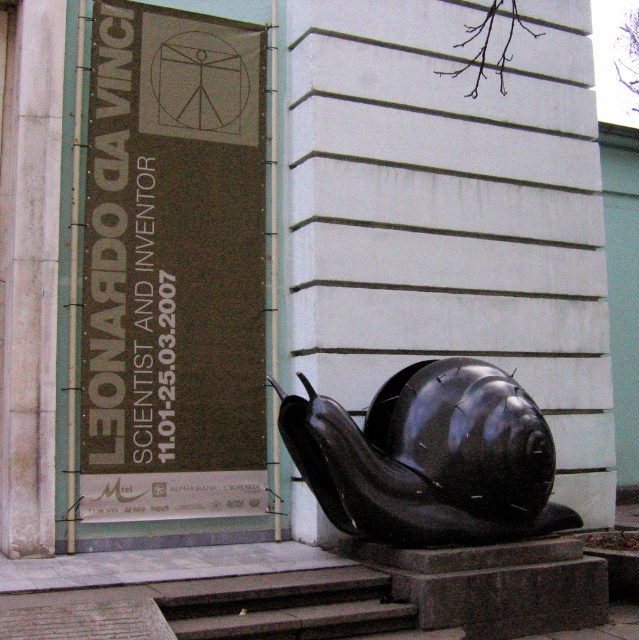
Does point (449, 506) come in front of point (295, 604)?

No.

The image size is (639, 640). Identify the location of black matte snail at center. (429, 458).